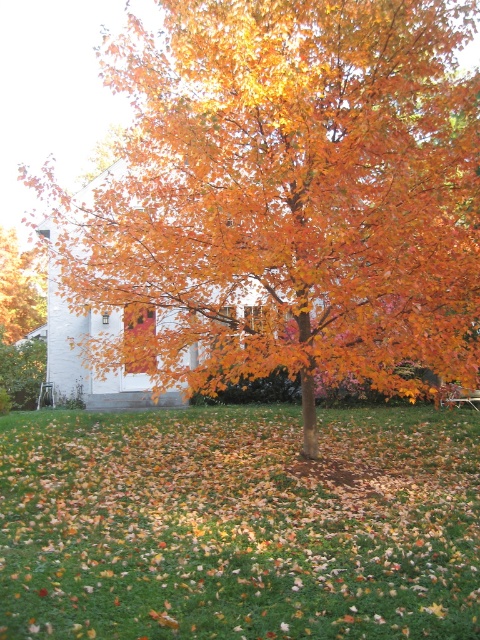
Question: Which of the following is the closest to the observer?

Choices:
 (A) pos(274,106)
 (B) pos(324,451)

Answer: (A)

Question: Which is nearer to the green grass at center?

Choices:
 (A) orange matte tree at center
 (B) golden glossy tree at center

Answer: (B)

Question: Does green grass at center have a lesser width compared to orange matte tree at center?

Choices:
 (A) yes
 (B) no

Answer: (B)

Question: Does golden glossy tree at center come behind green grass at center?

Choices:
 (A) no
 (B) yes

Answer: (B)

Question: Which is nearer to the green grass at center?

Choices:
 (A) orange matte tree at center
 (B) golden glossy tree at center

Answer: (B)

Question: Is golden glossy tree at center below orange matte tree at center?

Choices:
 (A) no
 (B) yes

Answer: (B)